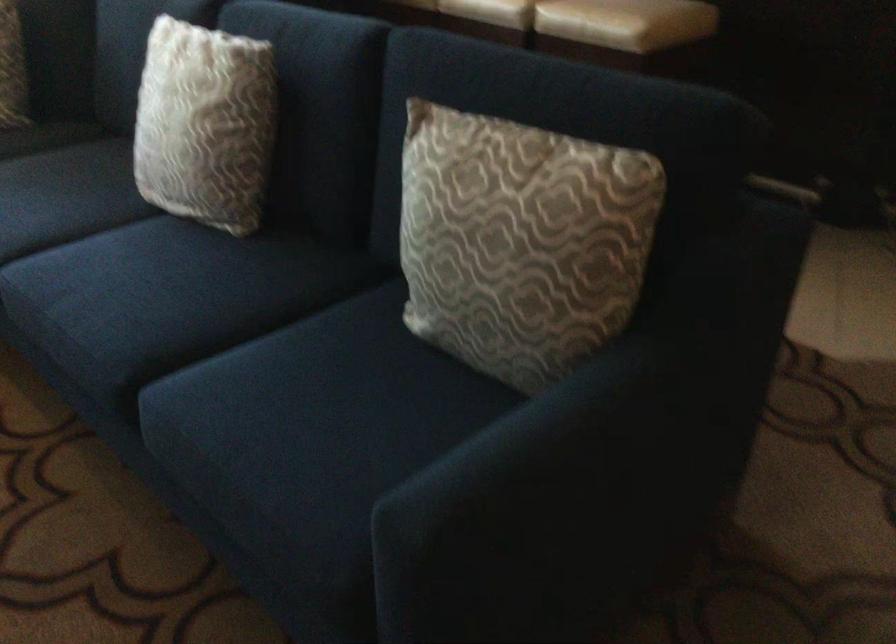
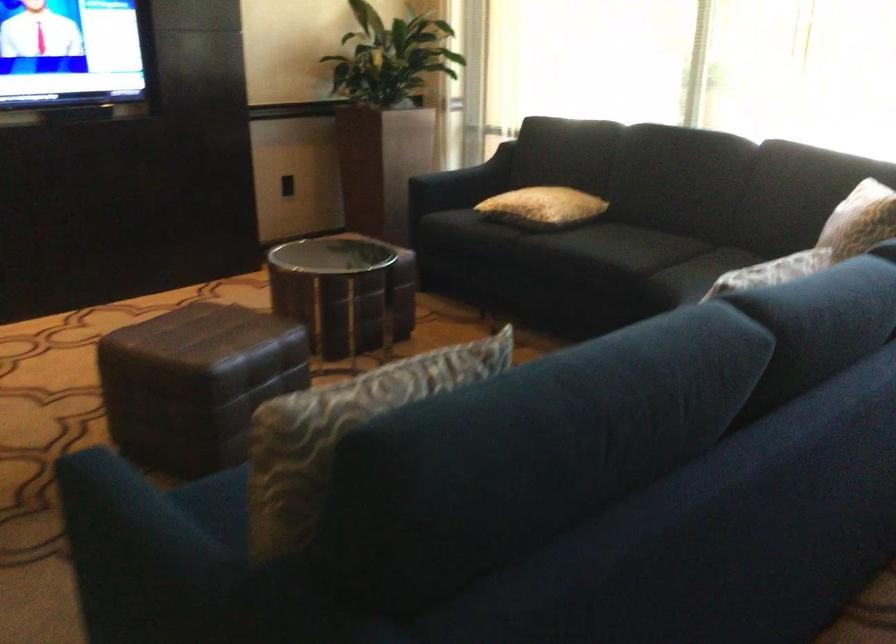
In the second image, find the point that corresponds to pixel 599 174 in the first image.

(340, 431)